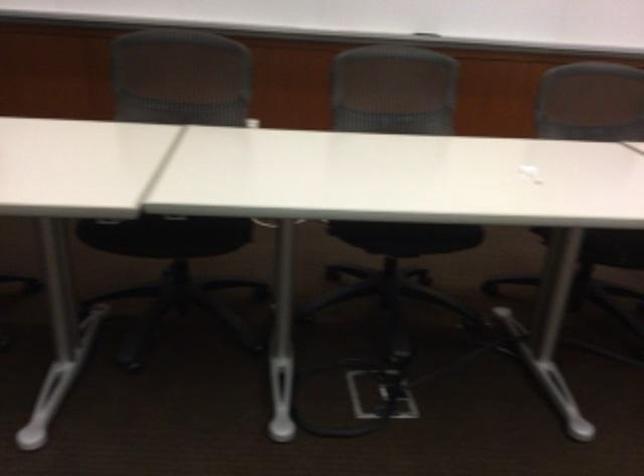
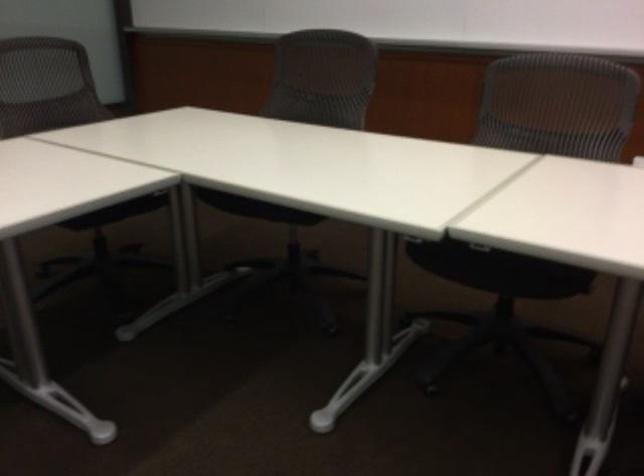
Question: The camera is either moving clockwise (left) or counter-clockwise (right) around the object. The first image is from the beginning of the video and the second image is from the end. Is the camera moving left or right when shooting the video?

Choices:
 (A) Left
 (B) Right

Answer: (B)